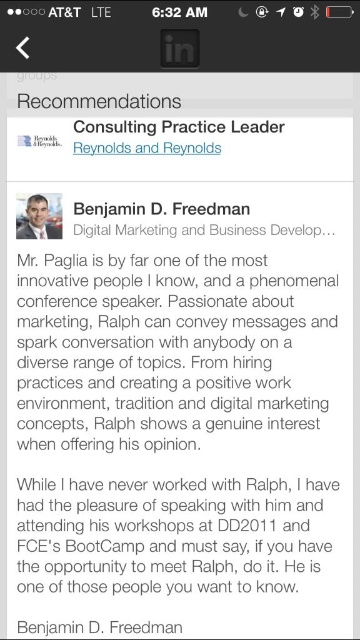
Consider the image. You are viewing a LinkedIn recommendation page. There is a black paper text at upper center and a light brown hair at upper left. Which object is taller?

The black paper text at upper center is much taller than the light brown hair at upper left.

What is the exact 2D coordinate of the black paper text at upper center?

The black paper text at upper center is located at the coordinate point of (182, 419).